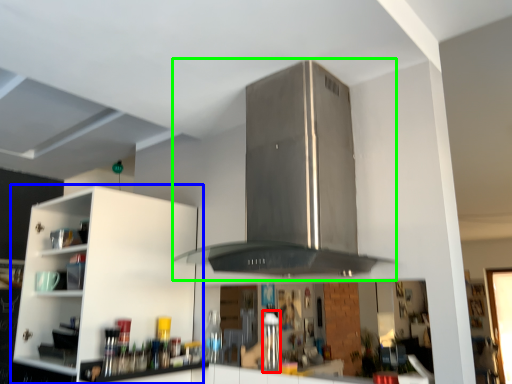
Question: Which object is positioned closest to appliance (highlighted by a red box)? Select from cabinetry (highlighted by a blue box) and vent (highlighted by a green box).

Choices:
 (A) cabinetry
 (B) vent

Answer: (B)